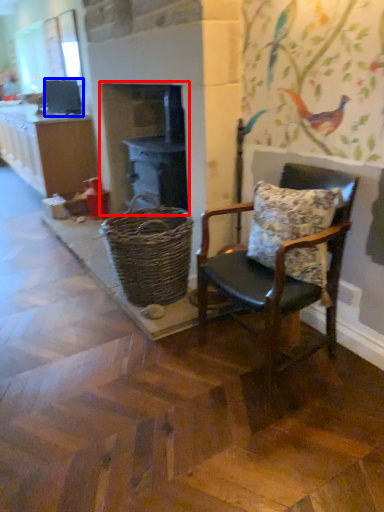
Question: Which point is closer to the camera, fireplace (highlighted by a red box) or appliance (highlighted by a blue box)?

Choices:
 (A) fireplace
 (B) appliance

Answer: (A)